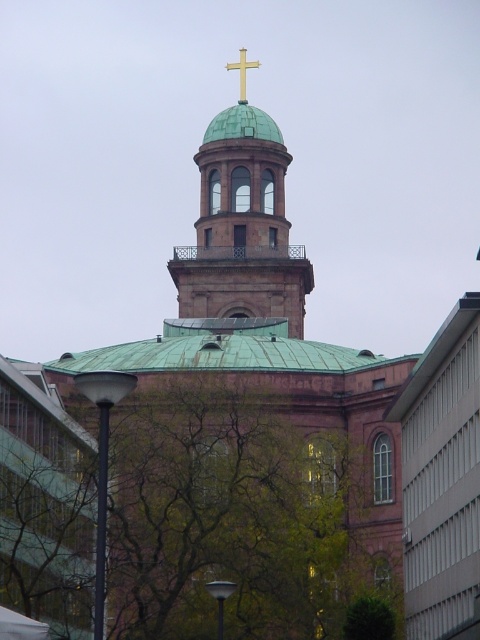
Does green leafy tree at center have a larger size compared to green copper dome at upper center?

Correct, green leafy tree at center is larger in size than green copper dome at upper center.

Consider the image. Does green leafy tree at center have a greater height compared to green copper dome at upper center?

Incorrect, green leafy tree at center's height is not larger of green copper dome at upper center's.

Is point (120, 544) farther from viewer compared to point (248, 172)?

That is False.

At what (x,y) coordinates should I click in order to perform the action: click on green leafy tree at center. Please return your answer as a coordinate pair (x, y). Image resolution: width=480 pixels, height=640 pixels. Looking at the image, I should click on (230, 515).

Does point (168, 580) come behind point (251, 61)?

No, it is in front of (251, 61).

Does green leafy tree at center have a smaller size compared to gold metallic cross at upper center?

Incorrect, green leafy tree at center is not smaller in size than gold metallic cross at upper center.

This screenshot has width=480, height=640. What do you see at coordinates (230, 515) in the screenshot? I see `green leafy tree at center` at bounding box center [230, 515].

This screenshot has height=640, width=480. In order to click on green leafy tree at center in this screenshot , I will do `click(230, 515)`.

Is point (274, 310) more distant than point (243, 68)?

No.

Consider the image. Between green copper dome at upper center and gold metallic cross at upper center, which one appears on the left side from the viewer's perspective?

gold metallic cross at upper center

Who is more forward, (256,243) or (241,76)?

Point (256,243) is in front.

The height and width of the screenshot is (640, 480). I want to click on green copper dome at upper center, so click(242, 227).